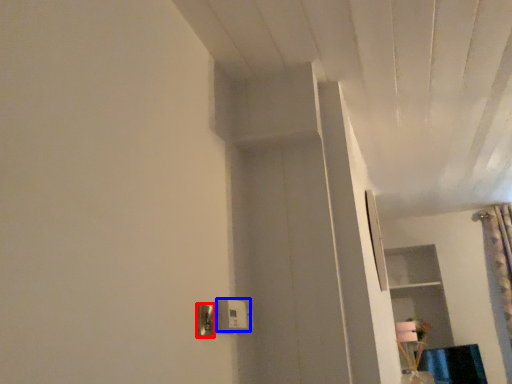
Question: Which point is closer to the camera, light switch (highlighted by a red box) or light switch (highlighted by a blue box)?

Choices:
 (A) light switch
 (B) light switch

Answer: (A)